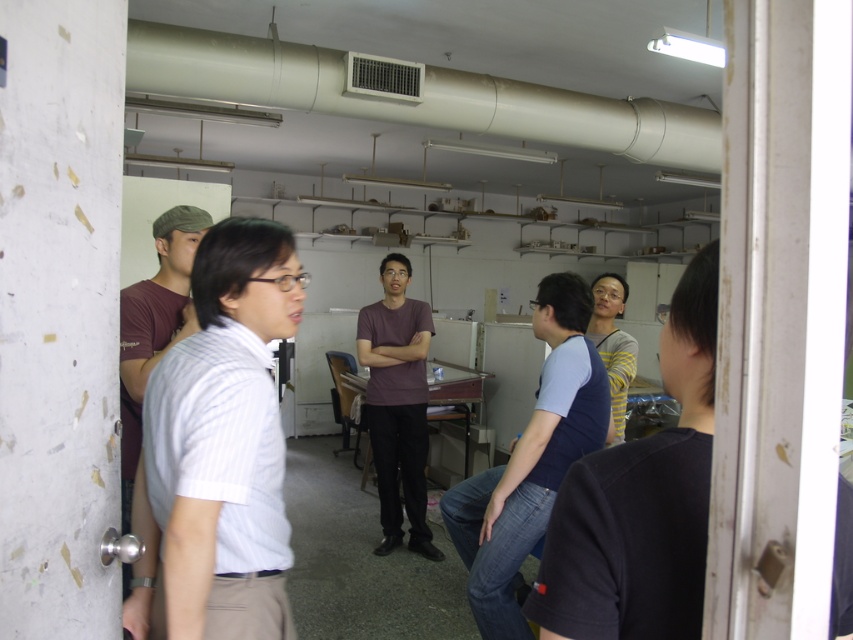
The image size is (853, 640). What do you see at coordinates (219, 451) in the screenshot?
I see `white striped shirt at left` at bounding box center [219, 451].

Can you confirm if white striped shirt at left is positioned to the left of maroon cotton t-shirt at left?

In fact, white striped shirt at left is to the right of maroon cotton t-shirt at left.

Which is in front, point (225, 460) or point (160, 227)?

Point (225, 460) is more forward.

You are a GUI agent. You are given a task and a screenshot of the screen. Output one action in this format:
    pyautogui.click(x=<x>, y=<y>)
    Task: Click on the white striped shirt at left
    This screenshot has height=640, width=853.
    Given the screenshot: What is the action you would take?
    pyautogui.click(x=219, y=451)

Which of these two, white striped shirt at left or blue denim jeans at center, stands taller?

Standing taller between the two is blue denim jeans at center.

Who is more distant from viewer, [223,317] or [584,362]?

Positioned behind is point [584,362].

In order to click on white striped shirt at left in this screenshot , I will do `click(219, 451)`.

You are a GUI agent. You are given a task and a screenshot of the screen. Output one action in this format:
    pyautogui.click(x=<x>, y=<y>)
    Task: Click on the blue denim jeans at center
    
    Given the screenshot: What is the action you would take?
    pyautogui.click(x=531, y=460)

Is point (469, 483) positioned after point (155, 321)?

Yes, it is.

Locate an element on the screen. The image size is (853, 640). blue denim jeans at center is located at coordinates click(531, 460).